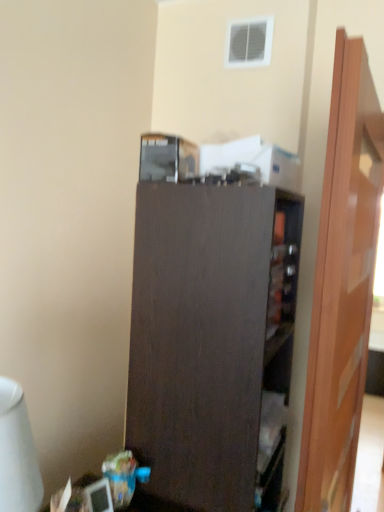
Question: From a real-world perspective, is white glossy table lamp at lower left physically above dark wood cupboard at center?

Choices:
 (A) yes
 (B) no

Answer: (A)

Question: Is white glossy table lamp at lower left aimed at dark wood cupboard at center?

Choices:
 (A) yes
 (B) no

Answer: (B)

Question: From the image's perspective, is white glossy table lamp at lower left located above dark wood cupboard at center?

Choices:
 (A) no
 (B) yes

Answer: (B)

Question: Can you confirm if white glossy table lamp at lower left is positioned to the right of dark wood cupboard at center?

Choices:
 (A) no
 (B) yes

Answer: (A)

Question: Is white glossy table lamp at lower left outside of dark wood cupboard at center?

Choices:
 (A) no
 (B) yes

Answer: (B)

Question: Is white glossy table lamp at lower left at the left side of dark wood cupboard at center?

Choices:
 (A) no
 (B) yes

Answer: (B)

Question: Is wooden door at right positioned with its back to dark wood cupboard at center?

Choices:
 (A) no
 (B) yes

Answer: (B)

Question: Is the depth of wooden door at right greater than that of dark wood cupboard at center?

Choices:
 (A) no
 (B) yes

Answer: (A)

Question: Is dark wood cupboard at center completely or partially inside wooden door at right?

Choices:
 (A) yes
 (B) no

Answer: (B)

Question: Is wooden door at right in front of dark wood cupboard at center?

Choices:
 (A) yes
 (B) no

Answer: (A)

Question: From the image's perspective, is wooden door at right under dark wood cupboard at center?

Choices:
 (A) yes
 (B) no

Answer: (B)

Question: Does wooden door at right have a larger size compared to dark wood cupboard at center?

Choices:
 (A) no
 (B) yes

Answer: (A)

Question: Does dark wood cupboard at center contain wooden door at right?

Choices:
 (A) yes
 (B) no

Answer: (B)